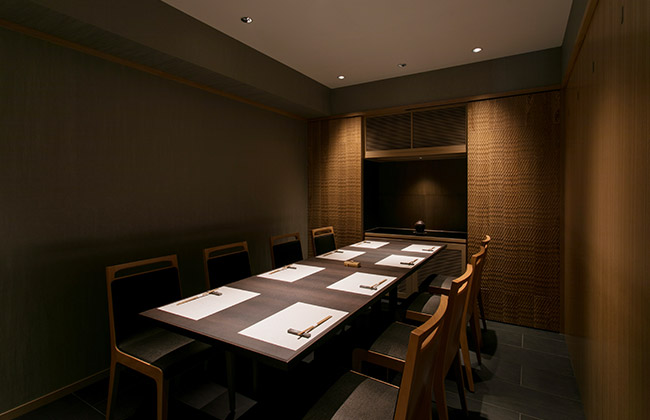
At what (x,y) coordinates should I click in order to perform the action: click on wooden chair frame. Please return your answer as a coordinate pair (x, y). The image size is (650, 420). Looking at the image, I should click on (142, 368).